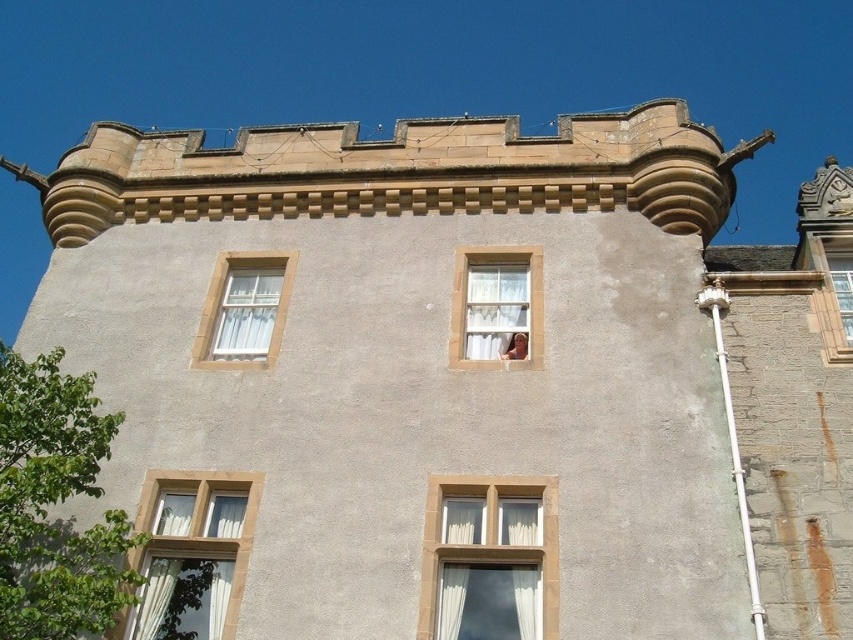
You are a maintenance worker needing to replace the glass in both the white textured window at lower left and the white textured window at center. You have a ladder that is 35 feet long. Can you safely reach both windows using the same ladder without moving it?

The white textured window at lower left and white textured window at center are 37.99 feet apart from each other. Since the ladder is only 35 feet long, it is not long enough to safely reach both windows without moving it.

You are standing in front of the historic building and want to determine the relative positions of two points marked on its facade. Which of the two points, point (497, 323) or point (260, 337), is closer to you?

Point (497, 323) is closer to the viewer than point (260, 337).

You are standing in front of the historic building and notice two windows, the white textured window at lower left and the white textured window at center. Which window appears closer to you?

The white textured window at lower left appears closer because it is in front of the white textured window at center.